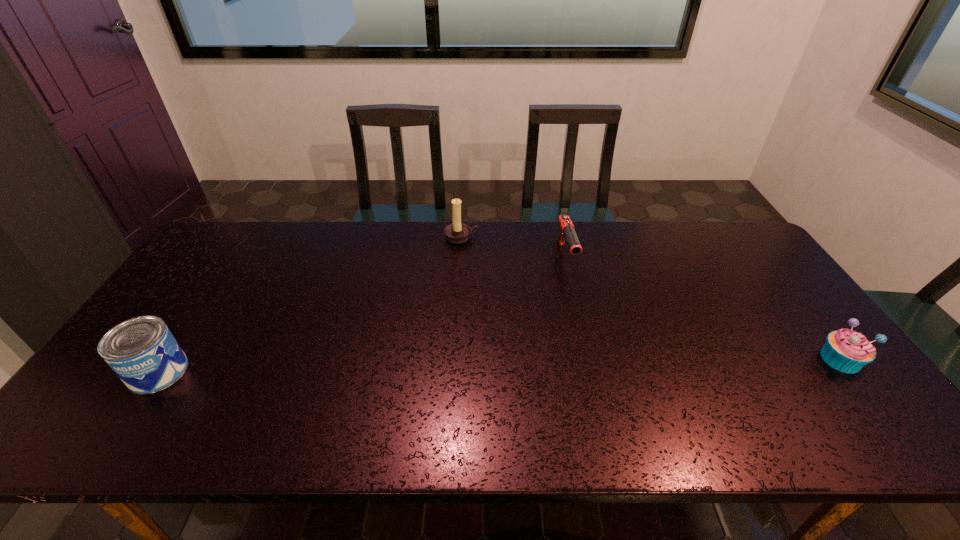
Locate an element on the screen. free space on the desktop that is between the can and the rightmost object and is positioned on the wick of the second object from left to right is located at coordinates (491, 366).

In order to click on vacant space on the desktop that is between the leftmost object and the rightmost object and is positioned at the aiming end of the second object from right to left in this screenshot , I will do `click(603, 363)`.